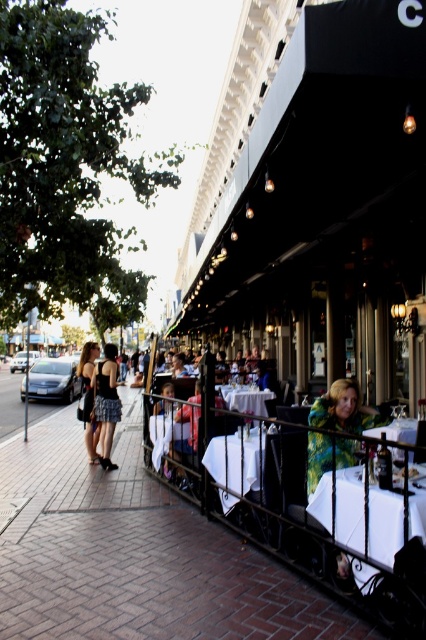
Question: Can you confirm if white glossy table at center is wider than white tablecloth at center?

Choices:
 (A) no
 (B) yes

Answer: (A)

Question: Which of the following is the closest to the observer?

Choices:
 (A) (100, 394)
 (B) (219, 492)
 (C) (92, 445)
 (D) (345, 449)

Answer: (D)

Question: Does matte black dress at center have a smaller size compared to white glossy table at lower right?

Choices:
 (A) yes
 (B) no

Answer: (A)

Question: Which point is farther to the camera?

Choices:
 (A) (221, 461)
 (B) (399, 502)
 (C) (414, 440)
 (D) (316, 420)

Answer: (C)

Question: Is the position of floral-patterned jacket at center less distant than that of matte black dress at left?

Choices:
 (A) yes
 (B) no

Answer: (A)

Question: Which of these objects is positioned farthest from the matte black dress at left?

Choices:
 (A) brick pavement at lower center
 (B) floral-patterned jacket at center
 (C) white linen table at lower right

Answer: (B)